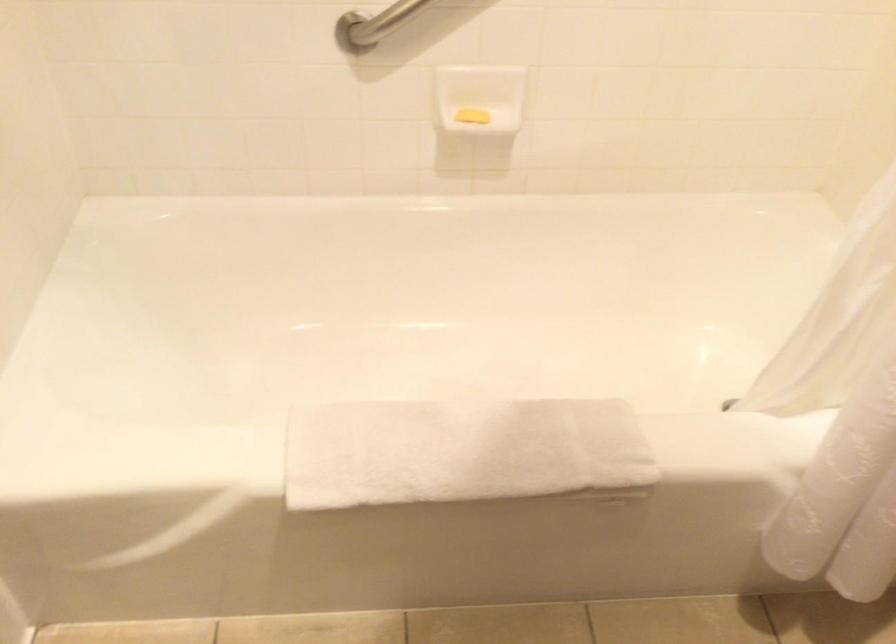
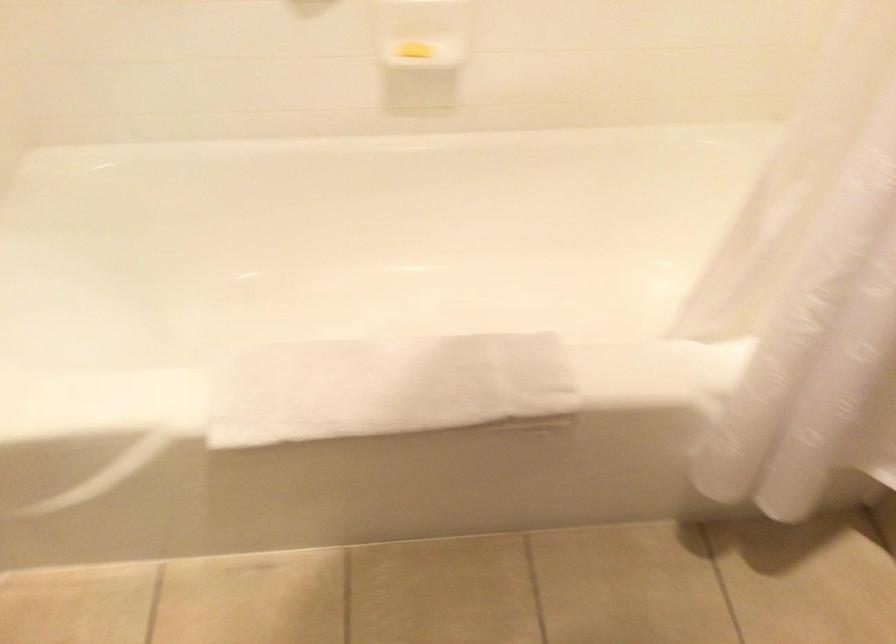
Question: Which direction would the cameraman need to move to produce the second image? Reply with the corresponding letter.

Choices:
 (A) Left
 (B) Right
 (C) Forward
 (D) Backward

Answer: (B)